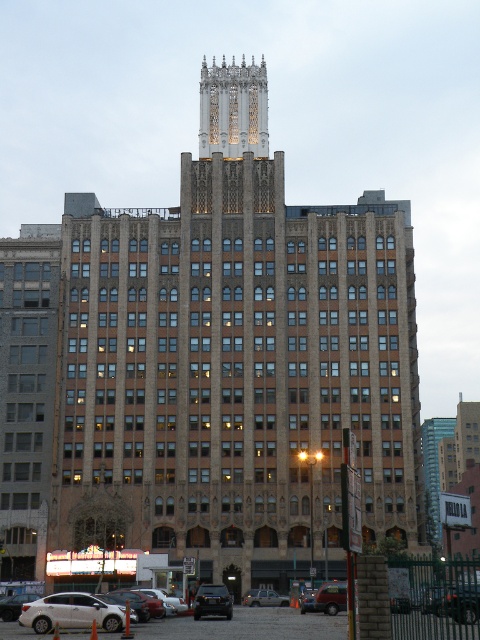
Is brown stone building at center to the left of shiny black suv at center from the viewer's perspective?

In fact, brown stone building at center is to the right of shiny black suv at center.

Between brown stone building at center and shiny black suv at center, which one appears on the right side from the viewer's perspective?

Positioned to the right is brown stone building at center.

The width and height of the screenshot is (480, 640). I want to click on brown stone building at center, so coord(239,356).

I want to click on brown stone building at center, so click(x=239, y=356).

Which of these two, brown stone building at center or matte black suv at center, stands shorter?

matte black suv at center is shorter.

Can you confirm if brown stone building at center is taller than matte black suv at center?

Yes, brown stone building at center is taller than matte black suv at center.

At what (x,y) coordinates should I click in order to perform the action: click on brown stone building at center. Please return your answer as a coordinate pair (x, y). This screenshot has height=640, width=480. Looking at the image, I should click on (239, 356).

Who is positioned more to the left, shiny black suv at center or matte black suv at center?

From the viewer's perspective, shiny black suv at center appears more on the left side.

This screenshot has width=480, height=640. What do you see at coordinates (213, 602) in the screenshot? I see `shiny black suv at center` at bounding box center [213, 602].

Is point (216, 612) positioned before point (268, 593)?

Yes.

I want to click on shiny black suv at center, so click(x=213, y=602).